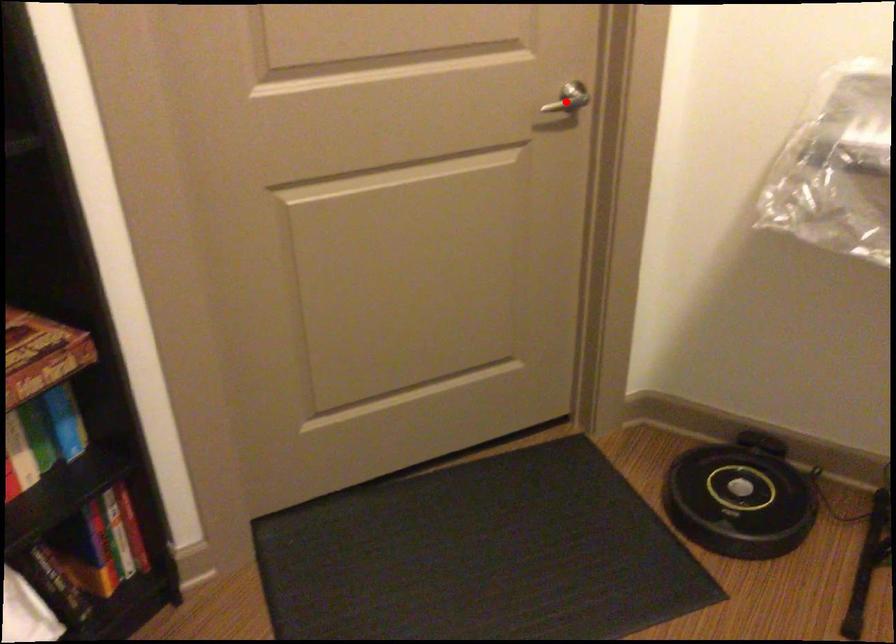
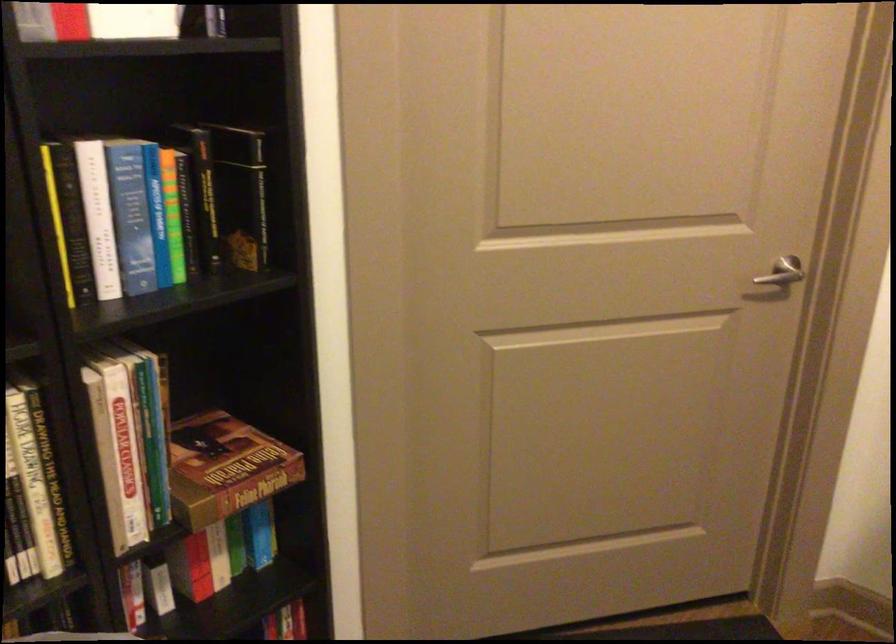
Where in the second image is the point corresponding to the highlighted location from the first image?

(781, 272)